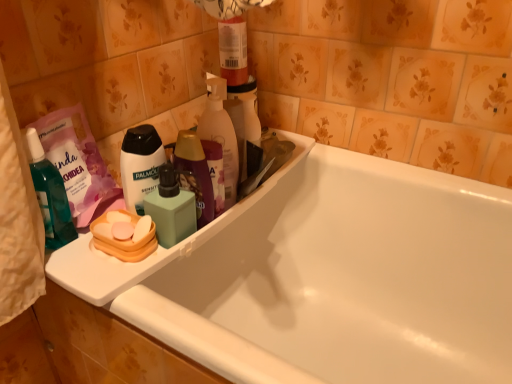
Question: Considering the relative sizes of orange plastic soap at left, positioned as the 2th personal care in top-to-bottom order, and white glossy bathtub at center in the image provided, is orange plastic soap at left, positioned as the 2th personal care in top-to-bottom order, thinner than white glossy bathtub at center?

Choices:
 (A) yes
 (B) no

Answer: (A)

Question: From the image's perspective, is orange plastic soap at left, positioned as the 2th personal care in top-to-bottom order, on top of white glossy bathtub at center?

Choices:
 (A) yes
 (B) no

Answer: (A)

Question: Is orange plastic soap at left, positioned as the 2th personal care in top-to-bottom order, positioned behind white glossy bathtub at center?

Choices:
 (A) no
 (B) yes

Answer: (B)

Question: Is orange plastic soap at left, positioned as the 2th personal care in top-to-bottom order, oriented towards white glossy bathtub at center?

Choices:
 (A) no
 (B) yes

Answer: (A)

Question: Could white glossy bathtub at center be considered to be inside orange plastic soap at left, the first personal care in the bottom-to-top sequence?

Choices:
 (A) no
 (B) yes

Answer: (A)

Question: Is orange plastic soap at left, the first personal care in the bottom-to-top sequence, bigger or smaller than translucent plastic bottle at upper center?

Choices:
 (A) small
 (B) big

Answer: (A)

Question: From the image's perspective, is orange plastic soap at left, positioned as the 2th personal care in top-to-bottom order, positioned above or below translucent plastic bottle at upper center?

Choices:
 (A) above
 (B) below

Answer: (B)

Question: From a real-world perspective, is orange plastic soap at left, positioned as the 2th personal care in top-to-bottom order, physically located above or below translucent plastic bottle at upper center?

Choices:
 (A) above
 (B) below

Answer: (B)

Question: Based on their positions, is orange plastic soap at left, positioned as the 2th personal care in top-to-bottom order, located to the left or right of translucent plastic bottle at upper center?

Choices:
 (A) left
 (B) right

Answer: (A)

Question: Considering their positions, is white matte body wash at center, arranged as the 1th personal care when viewed from the top, located in front of or behind white plastic tray at upper left?

Choices:
 (A) behind
 (B) front

Answer: (A)

Question: Which is correct: white matte body wash at center, placed as the second personal care when sorted from bottom to top, is inside white plastic tray at upper left, or outside of it?

Choices:
 (A) outside
 (B) inside

Answer: (A)

Question: Considering the positions of white matte body wash at center, placed as the second personal care when sorted from bottom to top, and white plastic tray at upper left in the image, is white matte body wash at center, placed as the second personal care when sorted from bottom to top, bigger or smaller than white plastic tray at upper left?

Choices:
 (A) small
 (B) big

Answer: (A)

Question: Is white matte body wash at center, arranged as the 1th personal care when viewed from the top, taller or shorter than white plastic tray at upper left?

Choices:
 (A) tall
 (B) short

Answer: (A)

Question: Does point (199, 119) appear closer or farther from the camera than point (143, 233)?

Choices:
 (A) closer
 (B) farther

Answer: (B)

Question: In terms of height, does translucent plastic bottle at upper center look taller or shorter compared to orange plastic soap at left, the first personal care in the bottom-to-top sequence?

Choices:
 (A) tall
 (B) short

Answer: (A)